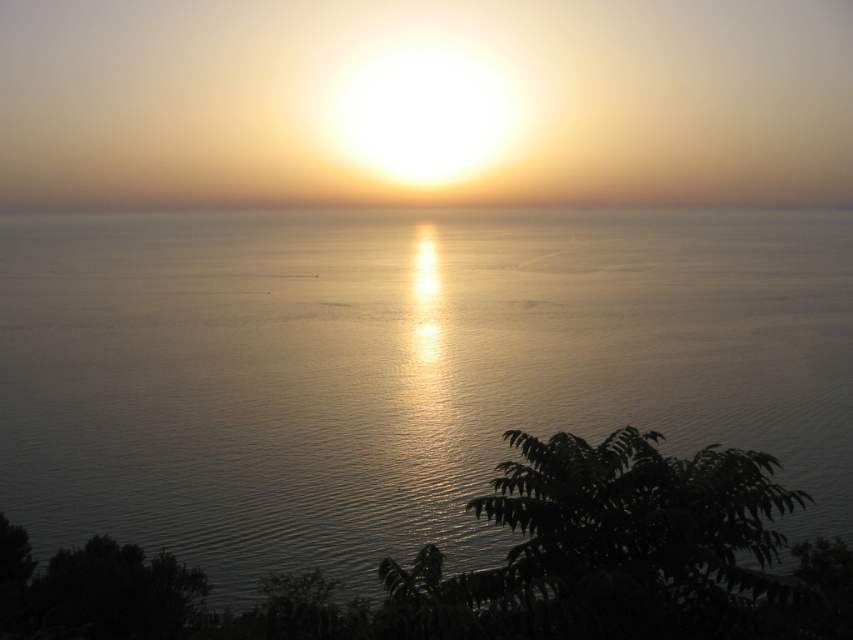
Who is shorter, silvery reflective water at center or smooth sand horizon at center?

smooth sand horizon at center is shorter.

Describe the element at coordinates (398, 369) in the screenshot. I see `silvery reflective water at center` at that location.

Does point (357, 449) lie in front of point (842, 204)?

Yes, it is in front of point (842, 204).

Locate an element on the screen. This screenshot has width=853, height=640. silvery reflective water at center is located at coordinates (398, 369).